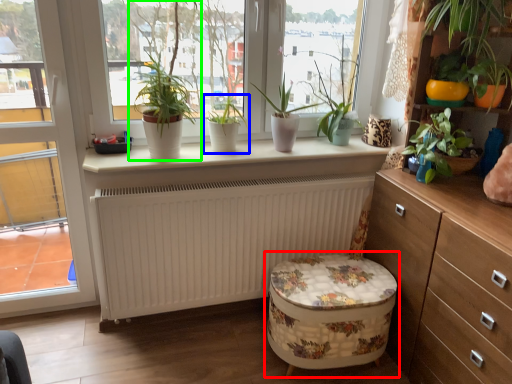
Question: Which is farther away from swivel chair (highlighted by a red box)? houseplant (highlighted by a blue box) or houseplant (highlighted by a green box)?

Choices:
 (A) houseplant
 (B) houseplant

Answer: (B)